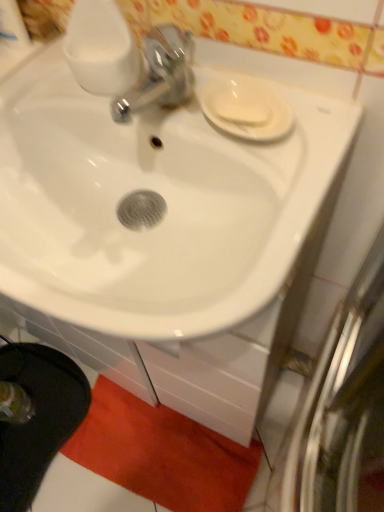
At what (x,y) coordinates should I click in order to perform the action: click on free space in front of white glossy saucer at upper right. Please return your answer as a coordinate pair (x, y). Looking at the image, I should click on [271, 197].